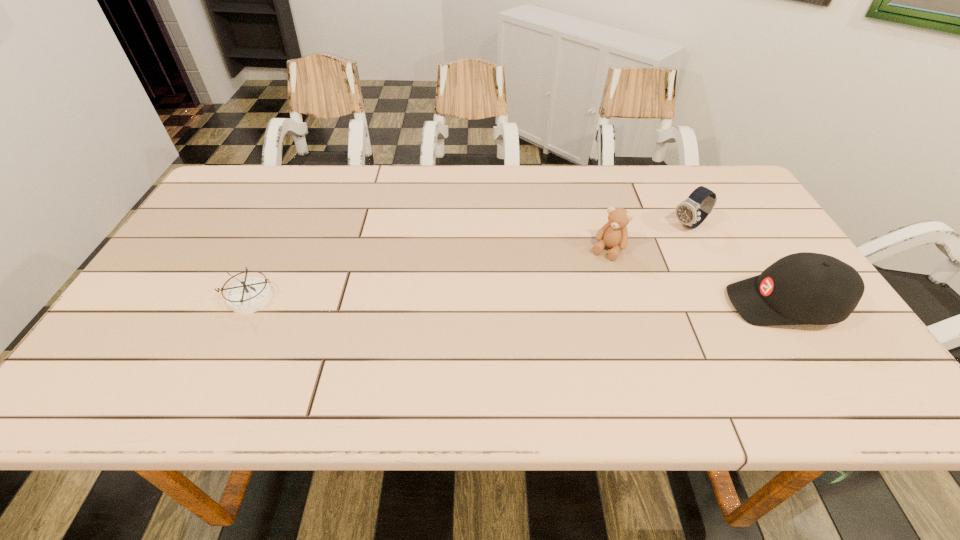
Locate an element on the screen. unoccupied area between the third nearest object and the farthest object is located at coordinates (648, 238).

The width and height of the screenshot is (960, 540). Find the location of `empty space between the third nearest object and the baseball cap`. empty space between the third nearest object and the baseball cap is located at coordinates (696, 277).

The width and height of the screenshot is (960, 540). In order to click on free point between the watch and the baseball cap in this screenshot , I will do `click(736, 265)`.

The height and width of the screenshot is (540, 960). Find the location of `free space between the watch and the leftmost object`. free space between the watch and the leftmost object is located at coordinates (469, 262).

In order to click on unoccupied area between the farthest object and the shortest object in this screenshot , I will do `click(469, 262)`.

Locate an element on the screen. Image resolution: width=960 pixels, height=540 pixels. object that is the closest to the teddy bear is located at coordinates (691, 212).

Choose which object is the nearest neighbor to the farthest object. Please provide its 2D coordinates. Your answer should be formatted as a tuple, i.e. [(x, y)], where the tuple contains the x and y coordinates of a point satisfying the conditions above.

[(614, 234)]

Identify the location of vacant region that satisfies the following two spatial constraints: 1. on the back side of the watch; 2. on the left side of the second object from left to right. The image size is (960, 540). (600, 226).

At what (x,y) coordinates should I click in order to perform the action: click on free region that satisfies the following two spatial constraints: 1. on the front side of the shortest object; 2. with a logo on the front of the baseball cap. Please return your answer as a coordinate pair (x, y). This screenshot has width=960, height=540. Looking at the image, I should click on (248, 304).

You are a GUI agent. You are given a task and a screenshot of the screen. Output one action in this format:
    pyautogui.click(x=<x>, y=<y>)
    Task: Click on the free space that satisfies the following two spatial constraints: 1. on the back side of the farthest object; 2. on the left side of the second object from left to right
    
    Given the screenshot: What is the action you would take?
    pyautogui.click(x=600, y=226)